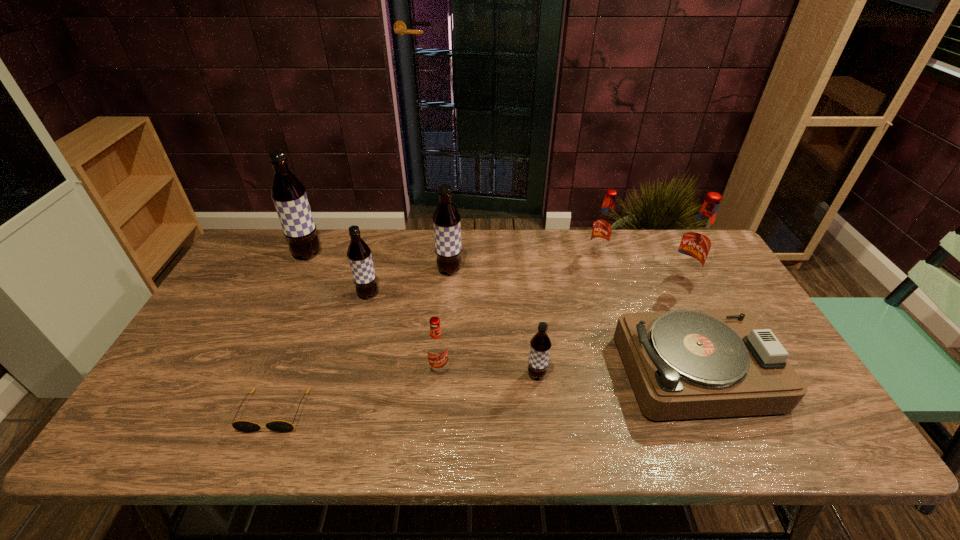
Image resolution: width=960 pixels, height=540 pixels. I want to click on unoccupied position between the tallest root beer and the second smallest brown root beer, so click(338, 274).

Image resolution: width=960 pixels, height=540 pixels. Find the location of `vacant area between the second red root beer from left to right and the nearest red root beer`. vacant area between the second red root beer from left to right and the nearest red root beer is located at coordinates (518, 312).

Identify the location of vacant area that lies between the farthest red root beer and the second root beer from left to right. (483, 274).

The height and width of the screenshot is (540, 960). In order to click on vacant point located between the leftmost root beer and the sunglasses in this screenshot , I will do `click(291, 333)`.

Locate an element on the screen. This screenshot has width=960, height=540. unoccupied position between the leftmost brown root beer and the biggest red root beer is located at coordinates (495, 266).

The width and height of the screenshot is (960, 540). Identify the location of free point between the shortest object and the second shortest object. (487, 392).

Point out which object is positioned as the third nearest to the third brown root beer from left to right. Please provide its 2D coordinates. Your answer should be formatted as a tuple, i.e. [(x, y)], where the tuple contains the x and y coordinates of a point satisfying the conditions above.

[(540, 344)]

Point out which object is positioned as the third nearest to the third object from left to right. Please provide its 2D coordinates. Your answer should be formatted as a tuple, i.e. [(x, y)], where the tuple contains the x and y coordinates of a point satisfying the conditions above.

[(437, 350)]

Identify which root beer is located as the fourth nearest to the shortest object. Please provide its 2D coordinates. Your answer should be formatted as a tuple, i.e. [(x, y)], where the tuple contains the x and y coordinates of a point satisfying the conditions above.

[(446, 220)]

What are the coordinates of `root beer that is the closest to the nearest brown root beer` in the screenshot? It's located at (437, 350).